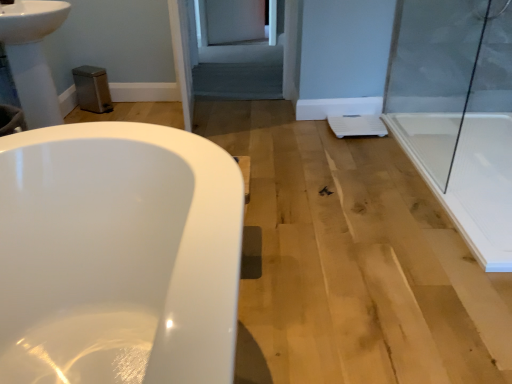
Question: Can white glossy sink at upper left be found inside gray fabric screen door at center?

Choices:
 (A) no
 (B) yes

Answer: (A)

Question: From a real-world perspective, is gray fabric screen door at center below white glossy sink at upper left?

Choices:
 (A) yes
 (B) no

Answer: (A)

Question: Is gray fabric screen door at center aimed at white glossy sink at upper left?

Choices:
 (A) no
 (B) yes

Answer: (A)

Question: Does gray fabric screen door at center have a greater height compared to white glossy sink at upper left?

Choices:
 (A) no
 (B) yes

Answer: (A)

Question: Does gray fabric screen door at center have a larger size compared to white glossy sink at upper left?

Choices:
 (A) no
 (B) yes

Answer: (B)

Question: Is gray fabric screen door at center at the right side of white glossy sink at upper left?

Choices:
 (A) yes
 (B) no

Answer: (A)

Question: Does silver metallic faucet at upper left appear on the left side of transparent glass shower door at right?

Choices:
 (A) yes
 (B) no

Answer: (A)

Question: Does silver metallic faucet at upper left have a greater height compared to transparent glass shower door at right?

Choices:
 (A) no
 (B) yes

Answer: (A)

Question: Does silver metallic faucet at upper left have a lesser width compared to transparent glass shower door at right?

Choices:
 (A) yes
 (B) no

Answer: (B)

Question: Is the depth of silver metallic faucet at upper left less than that of transparent glass shower door at right?

Choices:
 (A) yes
 (B) no

Answer: (B)

Question: Does silver metallic faucet at upper left have a smaller size compared to transparent glass shower door at right?

Choices:
 (A) yes
 (B) no

Answer: (A)

Question: Is silver metallic faucet at upper left further to camera compared to transparent glass shower door at right?

Choices:
 (A) yes
 (B) no

Answer: (A)

Question: Is gray fabric screen door at center in contact with transparent glass shower door at right?

Choices:
 (A) yes
 (B) no

Answer: (B)